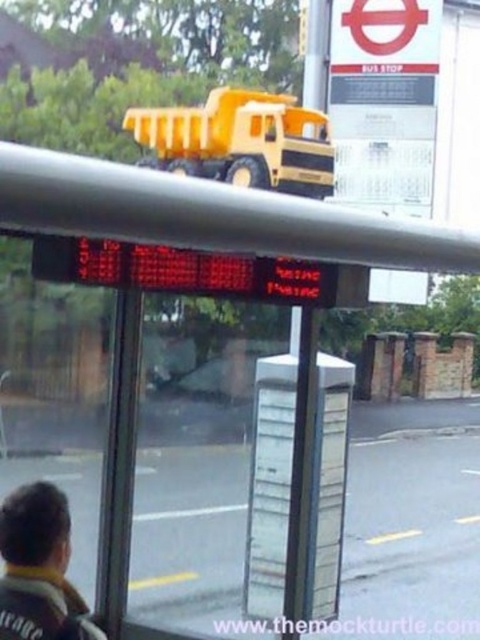
Between yellow matte toy truck at upper center and dark brown leather jacket at lower left, which one is positioned higher?

yellow matte toy truck at upper center is higher up.

Does point (303, 136) come in front of point (2, 547)?

No, (303, 136) is further to viewer.

Who is more distant from viewer, [250,184] or [0,545]?

The point [250,184] is behind.

Locate an element on the screen. yellow matte toy truck at upper center is located at coordinates (240, 141).